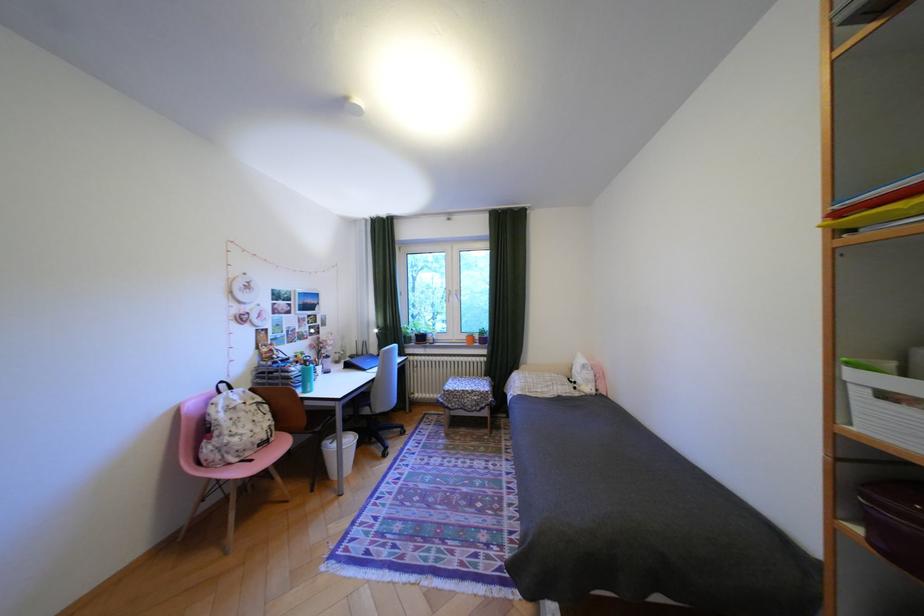
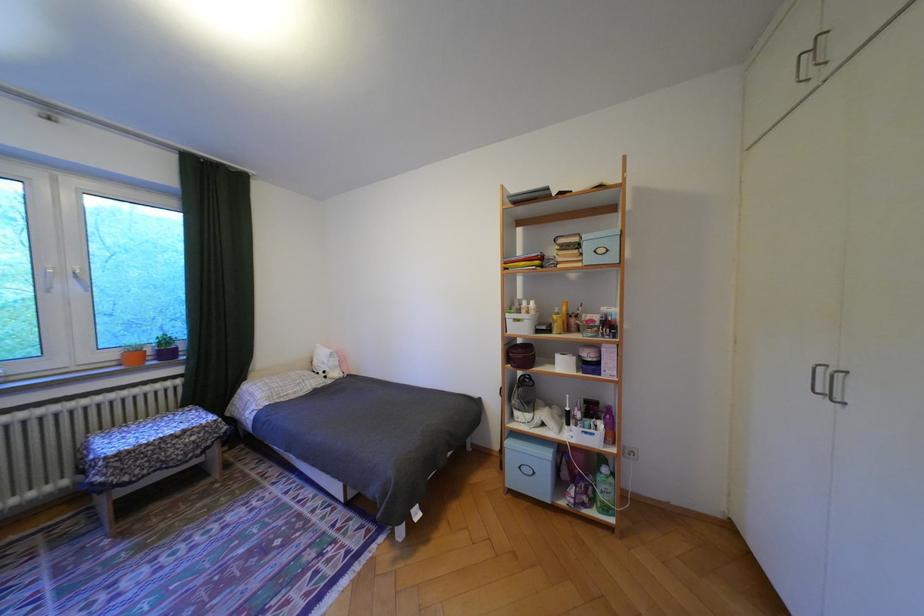
Locate, in the second image, the point that corresponds to [862,374] in the first image.

(518, 315)